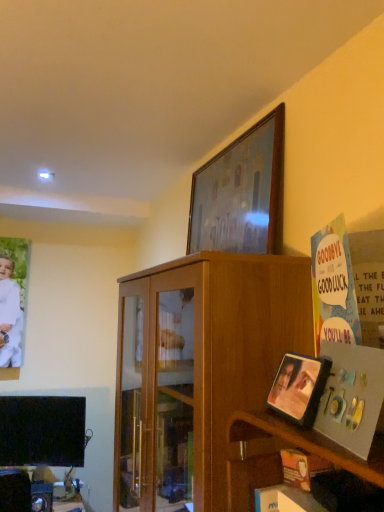
At what (x,y) coordinates should I click in order to perform the action: click on wooden photo frame at lower right, which appears as the 1th picture frame when viewed from the front. Please return your answer as a coordinate pair (x, y). The image size is (384, 512). Looking at the image, I should click on (299, 387).

What is the approximate width of white matte clothing at left?

1.25 inches.

What do you see at coordinates (9, 315) in the screenshot? Image resolution: width=384 pixels, height=512 pixels. I see `white matte clothing at left` at bounding box center [9, 315].

I want to click on wooden cabinet at upper center, so click(198, 369).

This screenshot has height=512, width=384. I want to click on wooden picture frame at upper center, placed as the 2th picture frame when sorted from front to back, so click(x=241, y=193).

Does wooden shelf at lower right have a larger size compared to wooden cabinet at upper center?

No, wooden shelf at lower right is not bigger than wooden cabinet at upper center.

Where is `cabinetry below the wooden shelf at lower right (from the image's perspective)`? Image resolution: width=384 pixels, height=512 pixels. cabinetry below the wooden shelf at lower right (from the image's perspective) is located at coordinates (198, 369).

Between point (366, 479) and point (135, 403), which one is positioned behind?

Positioned behind is point (135, 403).

Considering the sizes of objects wooden shelf at lower right and wooden cabinet at upper center in the image provided, who is thinner, wooden shelf at lower right or wooden cabinet at upper center?

With smaller width is wooden shelf at lower right.

From a real-world perspective, which object stands above the other?

In real-world perspective, wooden photo frame at lower right, which is the 2th picture frame in back-to-front order, is above.

Can you confirm if wooden photo frame at lower right, which is the 2th picture frame in back-to-front order, is positioned to the left of wooden cabinet at upper center?

Incorrect, wooden photo frame at lower right, which is the 2th picture frame in back-to-front order, is not on the left side of wooden cabinet at upper center.

Between wooden photo frame at lower right, placed as the second picture frame when sorted from top to bottom, and wooden cabinet at upper center, which one has larger width?

With larger width is wooden cabinet at upper center.

Which is closer to the camera, (293, 369) or (191, 358)?

The point (293, 369) is in front.

Consider the image. What's the angular difference between wooden picture frame at upper center, placed as the 2th picture frame when sorted from front to back, and white paper at right's facing directions?

wooden picture frame at upper center, placed as the 2th picture frame when sorted from front to back, and white paper at right are facing 13.7 degrees away from each other.

Which is more to the right, wooden picture frame at upper center, which appears as the 2th picture frame when ordered from the bottom, or white paper at right?

Positioned to the right is white paper at right.

From a real-world perspective, is wooden picture frame at upper center, placed as the 2th picture frame when sorted from front to back, physically located above or below white paper at right?

wooden picture frame at upper center, placed as the 2th picture frame when sorted from front to back, is above white paper at right.

Which point is more forward, (233,186) or (343,358)?

Positioned in front is point (343,358).

The width and height of the screenshot is (384, 512). In order to click on picture frame that is the 1st object to the left of the wooden shelf at lower right, starting at the anchor in this screenshot , I will do `click(299, 387)`.

Considering the relative positions of wooden photo frame at lower right, which is the 2th picture frame in back-to-front order, and wooden shelf at lower right in the image provided, is wooden photo frame at lower right, which is the 2th picture frame in back-to-front order, to the left or to the right of wooden shelf at lower right?

wooden photo frame at lower right, which is the 2th picture frame in back-to-front order, is positioned on wooden shelf at lower right's left side.

Measure the distance between wooden photo frame at lower right, marked as the 1th picture frame in a bottom-to-top arrangement, and wooden shelf at lower right.

The distance of wooden photo frame at lower right, marked as the 1th picture frame in a bottom-to-top arrangement, from wooden shelf at lower right is 5.19 inches.

From a real-world perspective, who is located higher, wooden photo frame at lower right, placed as the second picture frame when sorted from top to bottom, or wooden shelf at lower right?

In real-world perspective, wooden photo frame at lower right, placed as the second picture frame when sorted from top to bottom, is above.

From the image's perspective, which is above, white paper at right or wooden shelf at lower right?

white paper at right.

Considering the relative sizes of white paper at right and wooden shelf at lower right in the image provided, is white paper at right smaller than wooden shelf at lower right?

Yes, white paper at right is smaller than wooden shelf at lower right.

Find the location of a particular element. shelf behind the white paper at right is located at coordinates (279, 455).

Which object is wider, white paper at right or wooden shelf at lower right?

With larger width is wooden shelf at lower right.

In terms of height, does white matte clothing at left look taller or shorter compared to wooden picture frame at upper center, placed as the 2th picture frame when sorted from front to back?

In the image, white matte clothing at left appears to be taller than wooden picture frame at upper center, placed as the 2th picture frame when sorted from front to back.

Does white matte clothing at left have a greater width compared to wooden picture frame at upper center, which appears as the 1th picture frame when viewed from the back?

Incorrect, the width of white matte clothing at left does not surpass that of wooden picture frame at upper center, which appears as the 1th picture frame when viewed from the back.

Is white matte clothing at left facing away from wooden picture frame at upper center, which appears as the 2th picture frame when ordered from the bottom?

No, wooden picture frame at upper center, which appears as the 2th picture frame when ordered from the bottom, is not at the back of white matte clothing at left.

Is there a large distance between white matte clothing at left and wooden picture frame at upper center, the 1th picture frame positioned from the top?

Yes, white matte clothing at left is far from wooden picture frame at upper center, the 1th picture frame positioned from the top.

Is wooden shelf at lower right turned away from wooden photo frame at lower right, marked as the 1th picture frame in a bottom-to-top arrangement?

No.

You are a GUI agent. You are given a task and a screenshot of the screen. Output one action in this format:
    pyautogui.click(x=<x>, y=<y>)
    Task: Click on the picture frame that is the 1st one when counting upward from the wooden shelf at lower right (from the image's perspective)
    
    Given the screenshot: What is the action you would take?
    pyautogui.click(x=299, y=387)

Which is in front, point (227, 498) or point (324, 372)?

The point (324, 372) is closer.

Is wooden shelf at lower right taller or shorter than wooden photo frame at lower right, placed as the second picture frame when sorted from top to bottom?

wooden shelf at lower right is taller than wooden photo frame at lower right, placed as the second picture frame when sorted from top to bottom.

Locate an element on the screen. The width and height of the screenshot is (384, 512). cabinetry on the left of the wooden shelf at lower right is located at coordinates (198, 369).

You are a GUI agent. You are given a task and a screenshot of the screen. Output one action in this format:
    pyautogui.click(x=<x>, y=<y>)
    Task: Click on the cabinetry below the wooden photo frame at lower right, marked as the 1th picture frame in a bottom-to-top arrangement (from the image's perspective)
    
    Given the screenshot: What is the action you would take?
    pyautogui.click(x=198, y=369)

Estimate the real-world distances between objects in this image. Which object is further from white paper at right, wooden cabinet at upper center or wooden picture frame at upper center, which appears as the 1th picture frame when viewed from the back?

wooden picture frame at upper center, which appears as the 1th picture frame when viewed from the back, lies further to white paper at right than the other object.

When comparing their distances from wooden picture frame at upper center, which appears as the 1th picture frame when viewed from the back, does white paper at right or white matte clothing at left seem further?

white matte clothing at left.

From the image, which object appears to be farther from wooden shelf at lower right, wooden photo frame at lower right, which is the 2th picture frame in back-to-front order, or wooden cabinet at upper center?

wooden cabinet at upper center.

Consider the image. When comparing their distances from white matte clothing at left, does wooden photo frame at lower right, placed as the second picture frame when sorted from top to bottom, or white paper at right seem further?

white paper at right lies further to white matte clothing at left than the other object.

Which object lies nearer to the anchor point white paper at right, wooden picture frame at upper center, the 1th picture frame positioned from the top, or wooden photo frame at lower right, which appears as the 1th picture frame when viewed from the front?

wooden photo frame at lower right, which appears as the 1th picture frame when viewed from the front.

Consider the image. Estimate the real-world distances between objects in this image. Which object is further from wooden photo frame at lower right, which appears as the 1th picture frame when viewed from the front, white matte clothing at left or wooden picture frame at upper center, the 1th picture frame positioned from the top?

white matte clothing at left is further to wooden photo frame at lower right, which appears as the 1th picture frame when viewed from the front.

Considering their positions, is wooden photo frame at lower right, marked as the 1th picture frame in a bottom-to-top arrangement, positioned further to white matte clothing at left than wooden shelf at lower right?

Based on the image, wooden photo frame at lower right, marked as the 1th picture frame in a bottom-to-top arrangement, appears to be further to white matte clothing at left.

When comparing their distances from wooden cabinet at upper center, does wooden shelf at lower right or white matte clothing at left seem further?

white matte clothing at left lies further to wooden cabinet at upper center than the other object.

At what (x,y) coordinates should I click in order to perform the action: click on picture frame between white paper at right and wooden cabinet at upper center vertically. Please return your answer as a coordinate pair (x, y). This screenshot has width=384, height=512. Looking at the image, I should click on (299, 387).

The height and width of the screenshot is (512, 384). Identify the location of picture frame between white paper at right and wooden shelf at lower right in the vertical direction. (299, 387).

The height and width of the screenshot is (512, 384). Identify the location of shelf between white paper at right and wooden picture frame at upper center, which appears as the 2th picture frame when ordered from the bottom, along the z-axis. (279, 455).

You are a GUI agent. You are given a task and a screenshot of the screen. Output one action in this format:
    pyautogui.click(x=<x>, y=<y>)
    Task: Click on the shelf between wooden picture frame at upper center, which appears as the 2th picture frame when ordered from the bottom, and wooden cabinet at upper center, in the vertical direction
    This screenshot has width=384, height=512.
    Given the screenshot: What is the action you would take?
    pyautogui.click(x=279, y=455)